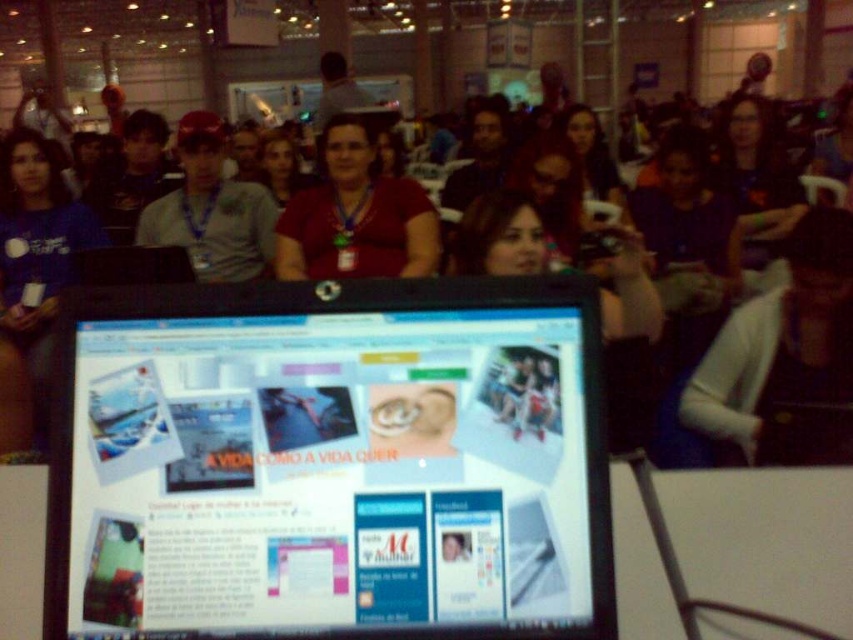
Question: Which point is closer to the camera?

Choices:
 (A) (485, 513)
 (B) (334, 243)
 (C) (825, 211)

Answer: (A)

Question: Does white sweater at center come in front of gray cotton shirt at left?

Choices:
 (A) yes
 (B) no

Answer: (A)

Question: Is matte black monitor at center thinner than gray cotton shirt at left?

Choices:
 (A) no
 (B) yes

Answer: (B)

Question: Among these points, which one is farthest from the camera?

Choices:
 (A) (88, 545)
 (B) (311, 276)
 (C) (718, 362)
 (D) (183, 118)

Answer: (D)

Question: Is white sweater at center above gray cotton shirt at left?

Choices:
 (A) no
 (B) yes

Answer: (A)

Question: Considering the real-world distances, which object is closest to the white sweater at center?

Choices:
 (A) matte red shirt at center
 (B) matte black monitor at center

Answer: (B)